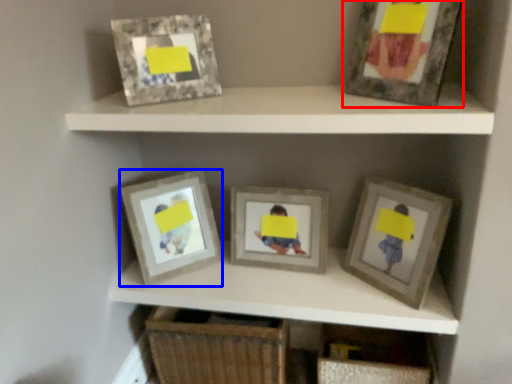
Question: Among these objects, which one is farthest to the camera, picture frame (highlighted by a red box) or picture frame (highlighted by a blue box)?

Choices:
 (A) picture frame
 (B) picture frame

Answer: (B)